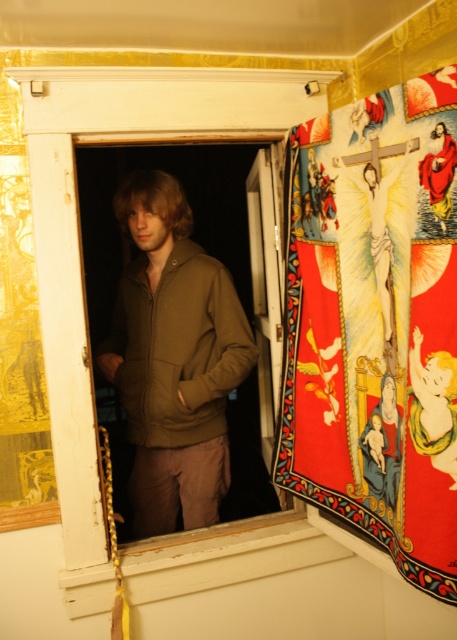
Which is in front, point (345, 332) or point (248, 349)?

Point (345, 332) is in front.

You are a GUI agent. You are given a task and a screenshot of the screen. Output one action in this format:
    pyautogui.click(x=<x>, y=<y>)
    Task: Click on the vibrant fabric tapestry at right
    The image size is (457, 640).
    Given the screenshot: What is the action you would take?
    pyautogui.click(x=376, y=323)

Does point (319, 209) come closer to viewer compared to point (217, 291)?

That is True.

Where is `vibrant fabric tapestry at right`? This screenshot has width=457, height=640. vibrant fabric tapestry at right is located at coordinates (376, 323).